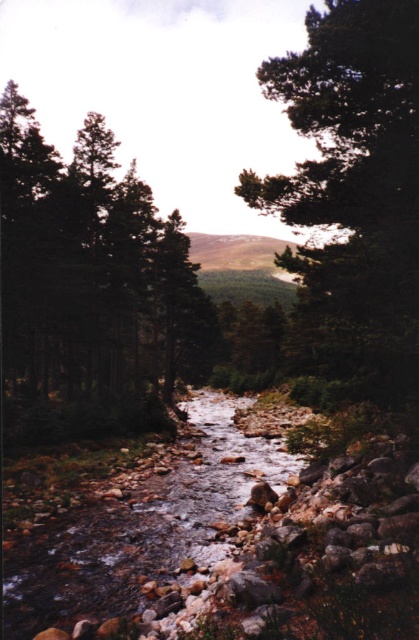
Question: Can you confirm if green matte tree at left is positioned to the right of clear water at stream center?

Choices:
 (A) yes
 (B) no

Answer: (B)

Question: Does green matte tree at left have a larger size compared to clear water at stream center?

Choices:
 (A) yes
 (B) no

Answer: (A)

Question: Which object is the closest to the clear water at stream center?

Choices:
 (A) green matte tree at center
 (B) green matte tree at left

Answer: (A)

Question: Among these points, which one is farthest from the camera?

Choices:
 (A) (111, 612)
 (B) (335, 216)

Answer: (B)

Question: From the image, what is the correct spatial relationship of green matte tree at left in relation to green matte tree at center?

Choices:
 (A) right
 (B) left

Answer: (B)

Question: Which is farther from the green matte tree at center?

Choices:
 (A) clear water at stream center
 (B) green matte tree at left

Answer: (B)